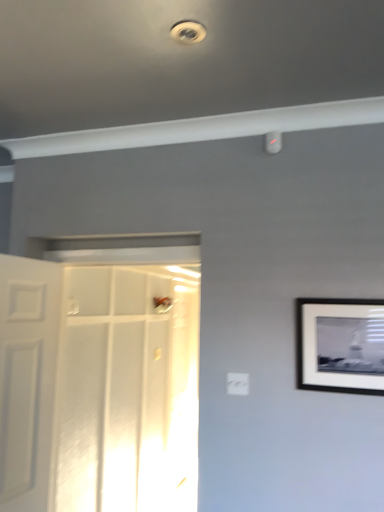
Question: Does white matte door at left, which ranks as the second door in right-to-left order, lie in front of white plastic droplight at upper center, the 2th droplight from the right?

Choices:
 (A) yes
 (B) no

Answer: (B)

Question: Can you confirm if white matte door at left, the first door viewed from the left, is wider than white plastic droplight at upper center, the second droplight in the bottom-to-top sequence?

Choices:
 (A) yes
 (B) no

Answer: (A)

Question: Is white matte door at left, which ranks as the second door in right-to-left order, smaller than white plastic droplight at upper center, the 2th droplight from the right?

Choices:
 (A) no
 (B) yes

Answer: (A)

Question: Can white plastic droplight at upper center, the 2th droplight from the right, be found inside white matte door at left, which ranks as the second door in right-to-left order?

Choices:
 (A) no
 (B) yes

Answer: (A)

Question: Considering the relative sizes of white matte door at left, the first door viewed from the left, and white plastic droplight at upper center, the 2th droplight from the right, in the image provided, is white matte door at left, the first door viewed from the left, thinner than white plastic droplight at upper center, the 2th droplight from the right,?

Choices:
 (A) yes
 (B) no

Answer: (B)

Question: From the image's perspective, is white matte door at left, the first door viewed from the left, on top of white plastic droplight at upper center, the 2th droplight from the right?

Choices:
 (A) yes
 (B) no

Answer: (B)

Question: Is white glossy door at center, the second door positioned from the left, facing away from white matte door at left, which ranks as the second door in right-to-left order?

Choices:
 (A) no
 (B) yes

Answer: (A)

Question: Is white glossy door at center, the 1th door viewed from the right, positioned behind white matte door at left, which ranks as the second door in right-to-left order?

Choices:
 (A) no
 (B) yes

Answer: (B)

Question: Considering the relative positions of white glossy door at center, the 1th door viewed from the right, and white matte door at left, which ranks as the second door in right-to-left order, in the image provided, is white glossy door at center, the 1th door viewed from the right, in front of white matte door at left, which ranks as the second door in right-to-left order,?

Choices:
 (A) no
 (B) yes

Answer: (A)

Question: From the image's perspective, is white glossy door at center, the 1th door viewed from the right, under white matte door at left, which ranks as the second door in right-to-left order?

Choices:
 (A) no
 (B) yes

Answer: (A)

Question: Is white glossy door at center, the 1th door viewed from the right, smaller than white matte door at left, which ranks as the second door in right-to-left order?

Choices:
 (A) yes
 (B) no

Answer: (B)

Question: From a real-world perspective, is white glossy door at center, the 1th door viewed from the right, below white matte door at left, the first door viewed from the left?

Choices:
 (A) yes
 (B) no

Answer: (B)

Question: Is white plastic electric outlet at center to the left of white plastic droplight at upper center, which is counted as the first droplight, starting from the top, from the viewer's perspective?

Choices:
 (A) yes
 (B) no

Answer: (B)